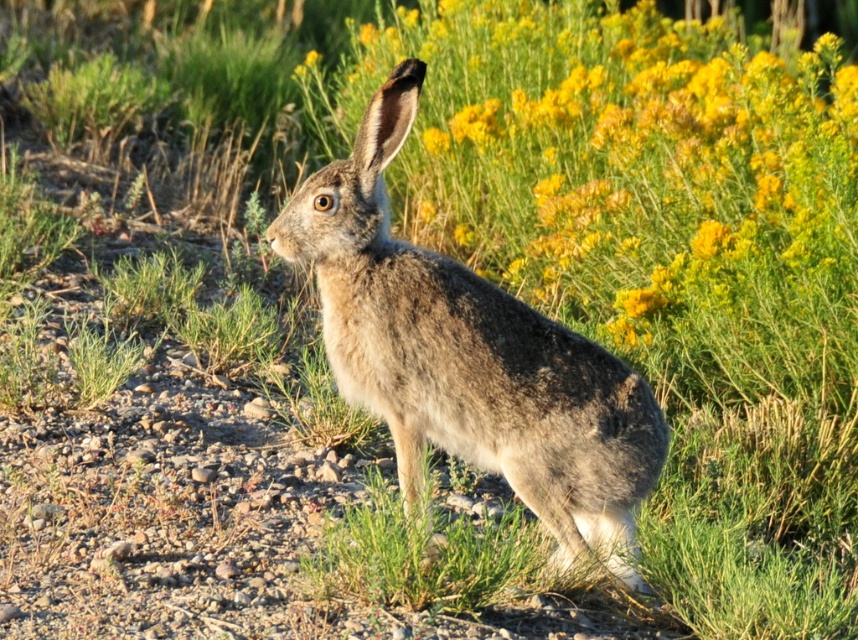
Question: Where is yellow-green textured flowers at upper right located in relation to fuzzy brown rabbit at center in the image?

Choices:
 (A) left
 (B) right

Answer: (B)

Question: Is yellow-green textured flowers at upper right to the left of fuzzy brown rabbit at center from the viewer's perspective?

Choices:
 (A) yes
 (B) no

Answer: (B)

Question: Which object is farther from the camera taking this photo?

Choices:
 (A) fuzzy brown rabbit at center
 (B) yellow-green textured flowers at upper right

Answer: (B)

Question: Can you confirm if yellow-green textured flowers at upper right is positioned to the right of fuzzy brown rabbit at center?

Choices:
 (A) no
 (B) yes

Answer: (B)